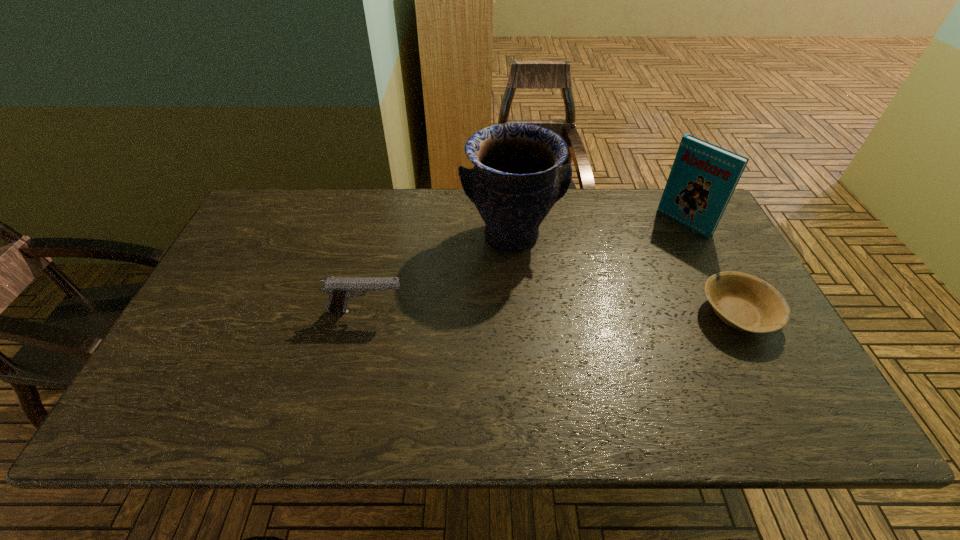
Where is `vacant space on the desktop that is between the leftmost object and the shortest object and is positioned on the front cover of the book`? vacant space on the desktop that is between the leftmost object and the shortest object and is positioned on the front cover of the book is located at coordinates (570, 313).

Identify the location of free space on the desktop that is between the leftmost object and the shortest object and is positioned on the front handle of the pottery. Image resolution: width=960 pixels, height=540 pixels. (532, 313).